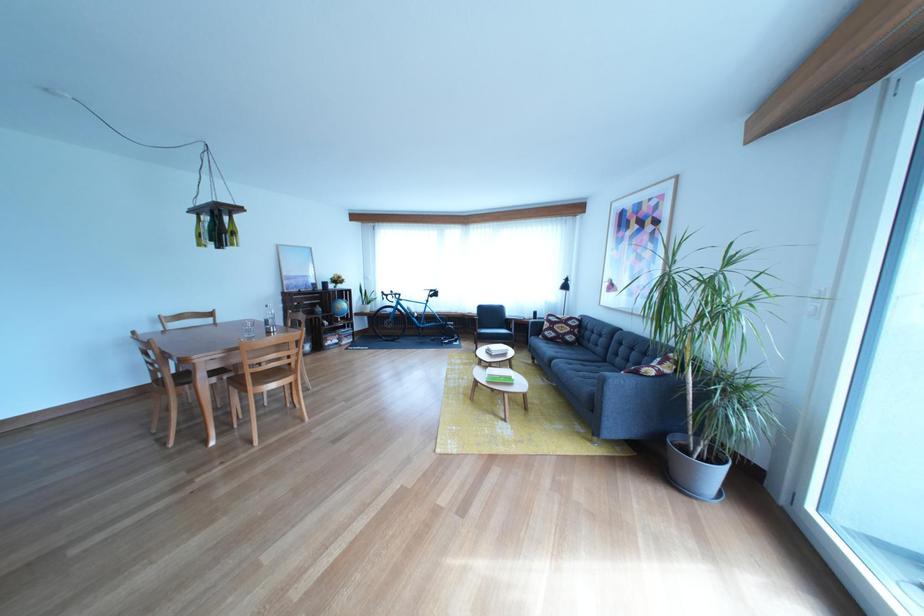
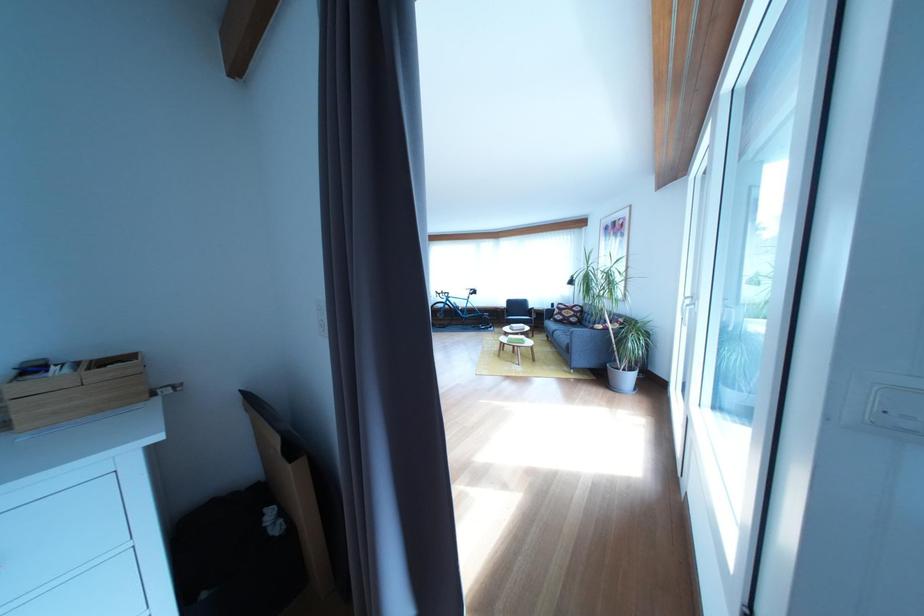
Where in the second image is the point corresponding to (699,456) from the first image?

(630, 375)